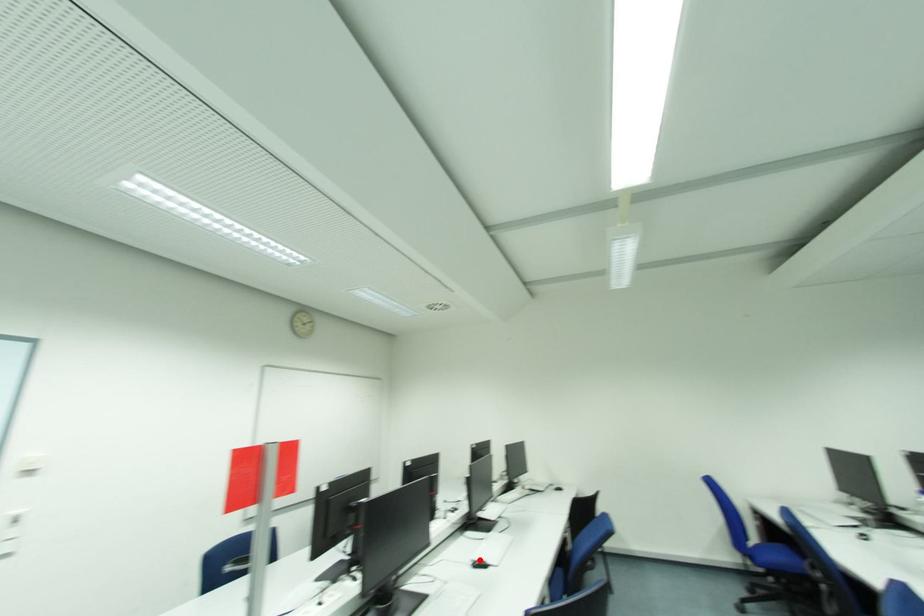
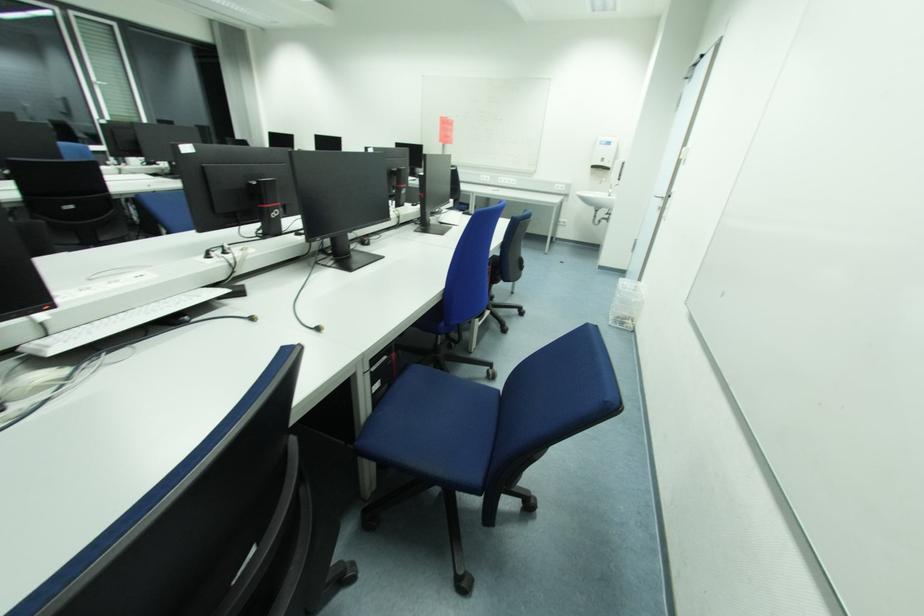
Question: I am providing you with two images of the same scene from different viewpoints. A red point is marked on the first image. Can you still see the location of the red point in image 2?

Choices:
 (A) Yes
 (B) No

Answer: (B)